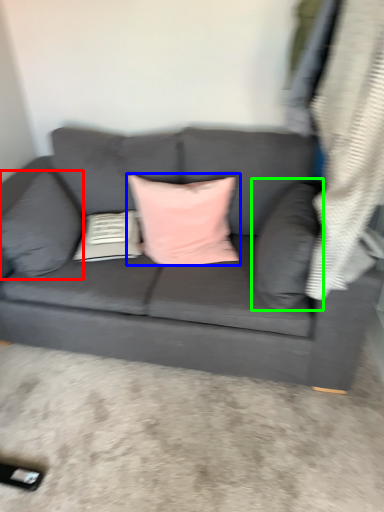
Question: Estimate the real-world distances between objects in this image. Which object is closer to pillow (highlighted by a red box), pillow (highlighted by a blue box) or pillow (highlighted by a green box)?

Choices:
 (A) pillow
 (B) pillow

Answer: (A)